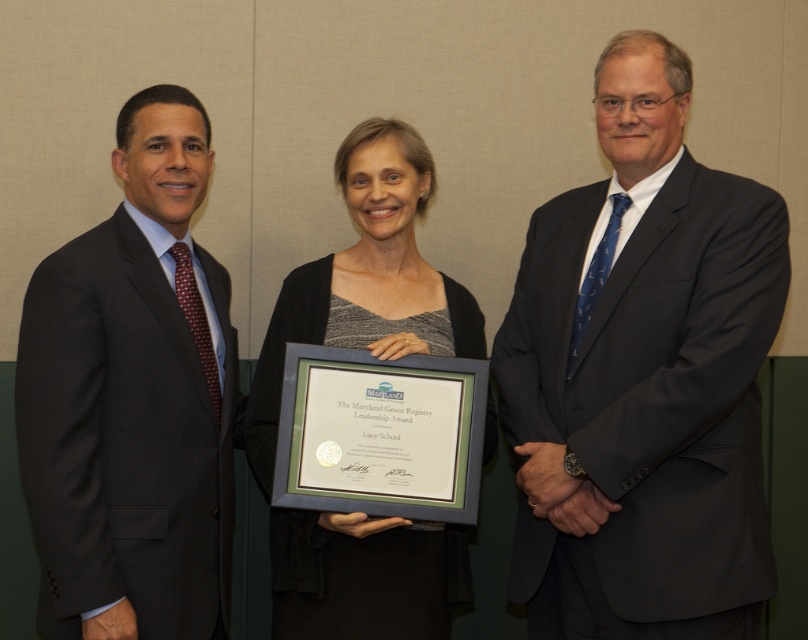
You are a photographer adjusting your camera settings to focus on two points in the image. The first point is at coordinate point (617, 435) and the second is at point (163, 403). Which point should you focus on if you want to capture the subject that is closer to the camera?

Point (617, 435) is closer to the camera than point (163, 403), so you should focus on point (617, 435) to capture the subject that is closer to the camera.